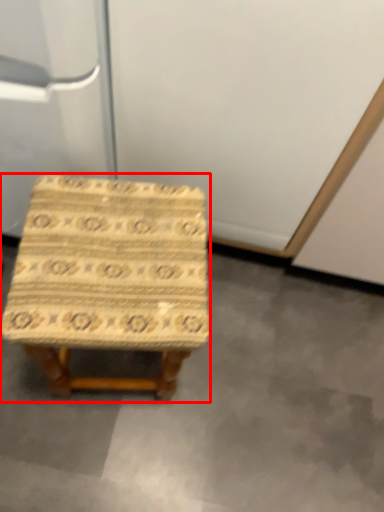
Question: From the image's perspective, what is the correct spatial positioning of stool (annotated by the red box) in reference to concrete?

Choices:
 (A) above
 (B) below

Answer: (A)